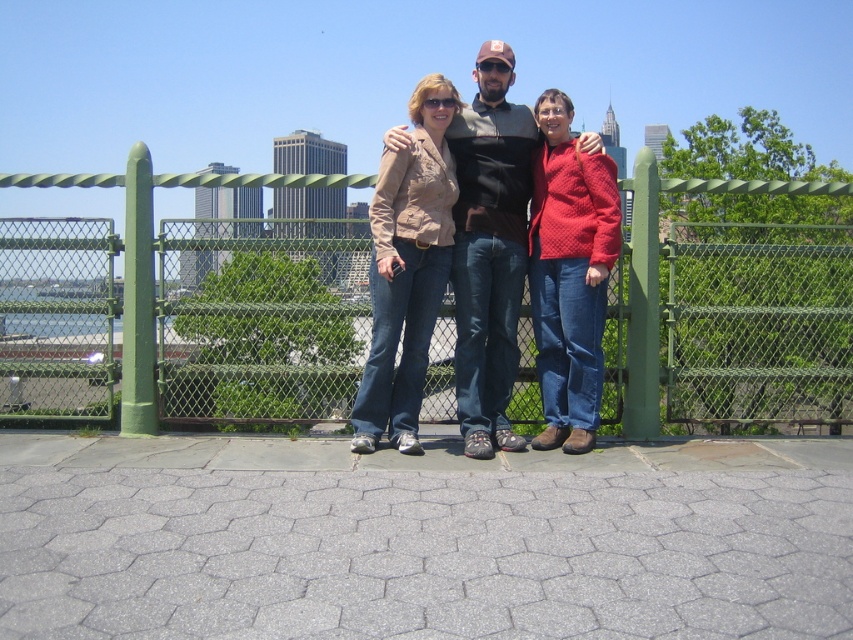
Does dark gray textured shirt at center have a larger size compared to matte black sunglasses at center?

Yes, dark gray textured shirt at center is bigger than matte black sunglasses at center.

Does point (498, 349) lie in front of point (438, 93)?

No, (498, 349) is behind (438, 93).

The height and width of the screenshot is (640, 853). I want to click on dark gray textured shirt at center, so click(x=489, y=248).

Which of these two, knitted red sweater at center or matte black sunglasses at center, stands shorter?

matte black sunglasses at center

Is point (607, 179) behind point (427, 100)?

Yes.

Between point (607, 224) and point (442, 106), which one is positioned behind?

The point (442, 106) is behind.

The image size is (853, 640). In order to click on knitted red sweater at center in this screenshot , I will do `click(569, 275)`.

Can you confirm if green chain-link fence at center is positioned below matte black sunglasses at center?

Indeed, green chain-link fence at center is positioned under matte black sunglasses at center.

Can you confirm if green chain-link fence at center is positioned to the right of matte black sunglasses at center?

Yes, green chain-link fence at center is to the right of matte black sunglasses at center.

Does point (132, 294) come closer to viewer compared to point (451, 102)?

No, it is behind (451, 102).

I want to click on green chain-link fence at center, so click(154, 259).